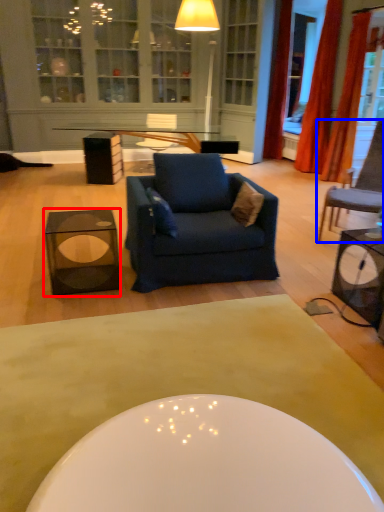
Question: Which object appears farthest to the camera in this image, table (highlighted by a red box) or chair (highlighted by a blue box)?

Choices:
 (A) table
 (B) chair

Answer: (B)